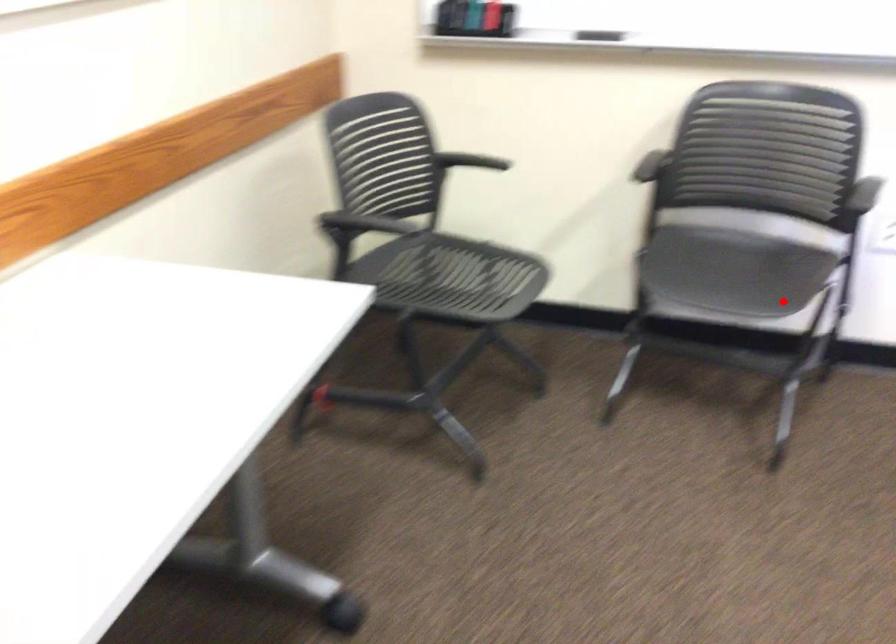
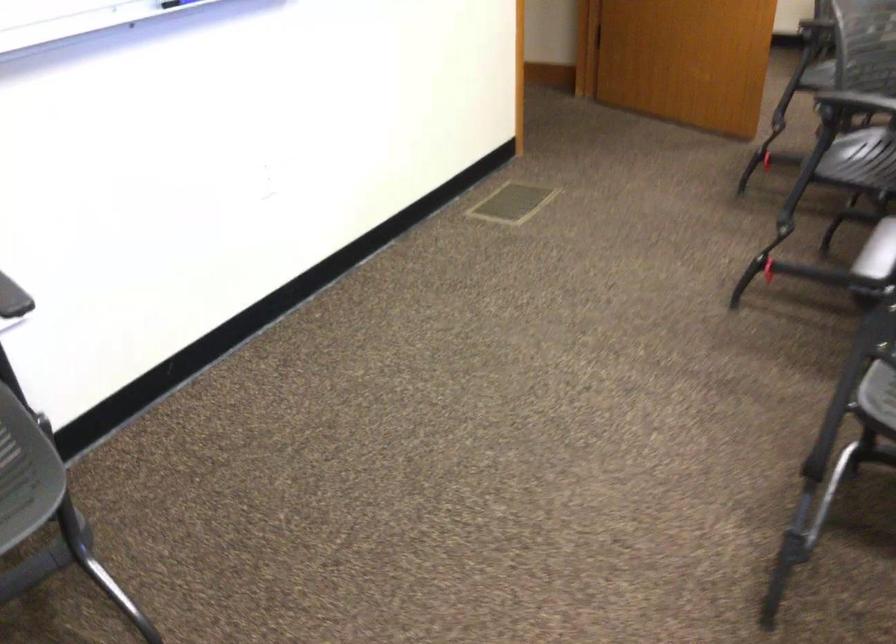
Locate, in the second image, the point that corresponds to the highlighted location in the first image.

(26, 473)